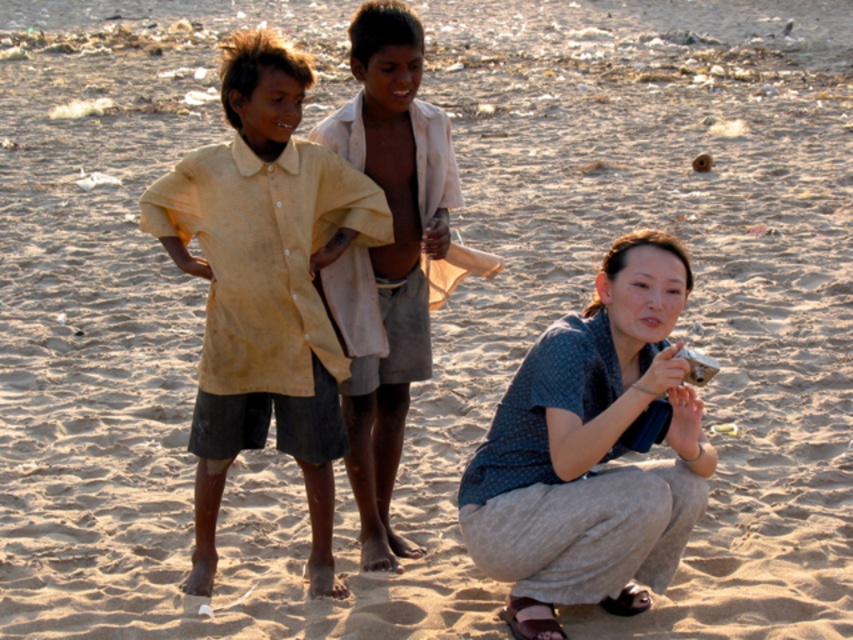
Question: Among these points, which one is nearest to the camera?

Choices:
 (A) (595, 596)
 (B) (409, 221)
 (C) (291, 326)

Answer: (A)

Question: Which of the following is the farthest from the observer?

Choices:
 (A) blue cotton shirt at lower right
 (B) yellow cotton shirt at center

Answer: (B)

Question: Does yellow cotton shirt at center appear under light brown cotton shirt at center?

Choices:
 (A) yes
 (B) no

Answer: (A)

Question: In this image, where is yellow cotton shirt at center located relative to blue cotton shirt at lower right?

Choices:
 (A) below
 (B) above

Answer: (B)

Question: Does yellow cotton shirt at center appear under blue cotton shirt at lower right?

Choices:
 (A) yes
 (B) no

Answer: (B)

Question: Which object is closer to the camera taking this photo?

Choices:
 (A) blue cotton shirt at lower right
 (B) yellow cotton shirt at center
 (C) light brown cotton shirt at center

Answer: (A)